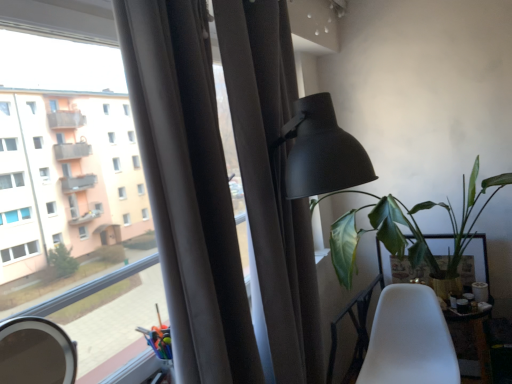
Describe the element at coordinates (224, 188) in the screenshot. I see `matte gray curtain at center` at that location.

Locate an element on the screen. matte black lamp at upper right is located at coordinates (321, 153).

What do you see at coordinates (36, 352) in the screenshot? The image size is (512, 384). I see `matte black mirror at lower left` at bounding box center [36, 352].

Where is `matte gray curtain at center`? The height and width of the screenshot is (384, 512). matte gray curtain at center is located at coordinates (224, 188).

Which object is thinner, white glossy table at lower right, which ranks as the 2th table in front-to-back order, or green leafy plant at right?

white glossy table at lower right, which ranks as the 2th table in front-to-back order, is thinner.

Is white glossy table at lower right, which ranks as the 2th table in front-to-back order, located outside green leafy plant at right?

white glossy table at lower right, which ranks as the 2th table in front-to-back order, lies outside green leafy plant at right's area.

From a real-world perspective, is white glossy table at lower right, which ranks as the 2th table in front-to-back order, on top of green leafy plant at right?

No, from a real-world perspective, white glossy table at lower right, which ranks as the 2th table in front-to-back order, is not on top of green leafy plant at right.

Considering the positions of objects white glossy table at lower right, which ranks as the 1th table in back-to-front order, and green leafy plant at right in the image provided, who is more to the left, white glossy table at lower right, which ranks as the 1th table in back-to-front order, or green leafy plant at right?

green leafy plant at right is more to the left.

From the picture: From a real-world perspective, is matte gray curtain at center on top of green leafy plant at right?

Correct, in the physical world, matte gray curtain at center is higher than green leafy plant at right.

Who is smaller, matte gray curtain at center or green leafy plant at right?

Smaller between the two is matte gray curtain at center.

Is green leafy plant at right at the back of matte gray curtain at center?

No, matte gray curtain at center's orientation is not away from green leafy plant at right.

Considering their positions, is matte gray curtain at center located in front of or behind white matte chair at lower right?

In the image, matte gray curtain at center appears in front of white matte chair at lower right.

Is white matte chair at lower right at the back of matte gray curtain at center?

That's not correct — matte gray curtain at center is not looking away from white matte chair at lower right.

Considering the sizes of matte gray curtain at center and white matte chair at lower right in the image, is matte gray curtain at center bigger or smaller than white matte chair at lower right?

In the image, matte gray curtain at center appears to be larger than white matte chair at lower right.

Is matte gray curtain at center spatially inside white matte chair at lower right, or outside of it?

matte gray curtain at center is spatially situated outside white matte chair at lower right.

Considering the positions of objects matte black lamp at upper right and matte gray curtain at center in the image provided, who is in front, matte black lamp at upper right or matte gray curtain at center?

Positioned in front is matte gray curtain at center.

Does matte black lamp at upper right have a lesser height compared to matte gray curtain at center?

Correct, matte black lamp at upper right is not as tall as matte gray curtain at center.

Is matte black lamp at upper right surrounding matte gray curtain at center?

No, matte gray curtain at center is not inside matte black lamp at upper right.

Is white matte chair at lower right at the back of matte black mirror at lower left?

No, matte black mirror at lower left is not facing away from white matte chair at lower right.

In the image, is matte black mirror at lower left on the left side or the right side of white matte chair at lower right?

In the image, matte black mirror at lower left appears on the left side of white matte chair at lower right.

Would you say matte black mirror at lower left is inside or outside white matte chair at lower right?

matte black mirror at lower left cannot be found inside white matte chair at lower right.

From the image's perspective, is matte black mirror at lower left above or below white matte chair at lower right?

Based on their image positions, matte black mirror at lower left is located above white matte chair at lower right.

From a real-world perspective, is wooden table at lower right, which appears as the 1th table when viewed from the front, over white matte chair at lower right?

No.

Could you tell me if wooden table at lower right, which is the 2th table from back to front, is facing white matte chair at lower right?

No, wooden table at lower right, which is the 2th table from back to front, is not aimed at white matte chair at lower right.

From the image's perspective, is wooden table at lower right, which is the 2th table from back to front, beneath white matte chair at lower right?

Yes, from the image's perspective, wooden table at lower right, which is the 2th table from back to front, is below white matte chair at lower right.

Between matte gray curtain at center and wooden table at lower right, which is the 2th table from back to front, which one has larger width?

With larger width is wooden table at lower right, which is the 2th table from back to front.

Is the surface of matte gray curtain at center in direct contact with wooden table at lower right, which appears as the 1th table when viewed from the front?

No.

Identify the location of curtain in front of the wooden table at lower right, which appears as the 1th table when viewed from the front. (224, 188).

Identify the location of houseplant on the left of white glossy table at lower right, which ranks as the 2th table in front-to-back order. (408, 227).

Where is `houseplant that appears behind the matte gray curtain at center`? The width and height of the screenshot is (512, 384). houseplant that appears behind the matte gray curtain at center is located at coordinates (x=408, y=227).

When comparing their distances from white glossy table at lower right, which ranks as the 1th table in back-to-front order, does matte black lamp at upper right or green leafy plant at right seem further?

matte black lamp at upper right.

Which object lies further to the anchor point wooden table at lower right, which is the 2th table from back to front, matte gray curtain at center or white matte chair at lower right?

matte gray curtain at center is positioned further to the anchor wooden table at lower right, which is the 2th table from back to front.

Estimate the real-world distances between objects in this image. Which object is further from matte gray curtain at center, matte black lamp at upper right or green leafy plant at right?

Based on the image, green leafy plant at right appears to be further to matte gray curtain at center.

Looking at this image, from the image, which object appears to be farther from green leafy plant at right, matte black mirror at lower left or white matte chair at lower right?

Among the two, matte black mirror at lower left is located further to green leafy plant at right.

Which object lies nearer to the anchor point matte black mirror at lower left, white matte chair at lower right or wooden table at lower right, which is the 2th table from back to front?

white matte chair at lower right is positioned closer to the anchor matte black mirror at lower left.

Looking at the image, which one is located further to white glossy table at lower right, which ranks as the 2th table in front-to-back order, matte black lamp at upper right or white matte chair at lower right?

matte black lamp at upper right is positioned further to the anchor white glossy table at lower right, which ranks as the 2th table in front-to-back order.

When comparing their distances from green leafy plant at right, does matte black lamp at upper right or matte black mirror at lower left seem closer?

The object closer to green leafy plant at right is matte black lamp at upper right.

In the scene shown: From the image, which object appears to be nearer to matte black mirror at lower left, wooden table at lower right, which is the 2th table from back to front, or matte gray curtain at center?

matte gray curtain at center.

Where is `table lamp located between matte black mirror at lower left and green leafy plant at right in the left-right direction`? The image size is (512, 384). table lamp located between matte black mirror at lower left and green leafy plant at right in the left-right direction is located at coordinates (321, 153).

Locate an element on the screen. table lamp situated between matte black mirror at lower left and white matte chair at lower right from left to right is located at coordinates (321, 153).

The width and height of the screenshot is (512, 384). I want to click on houseplant located between matte black mirror at lower left and white glossy table at lower right, which ranks as the 1th table in back-to-front order, in the left-right direction, so click(408, 227).

At what (x,y) coordinates should I click in order to perform the action: click on mirror positioned between matte gray curtain at center and white glossy table at lower right, which ranks as the 2th table in front-to-back order, from near to far. Please return your answer as a coordinate pair (x, y). The height and width of the screenshot is (384, 512). Looking at the image, I should click on (36, 352).